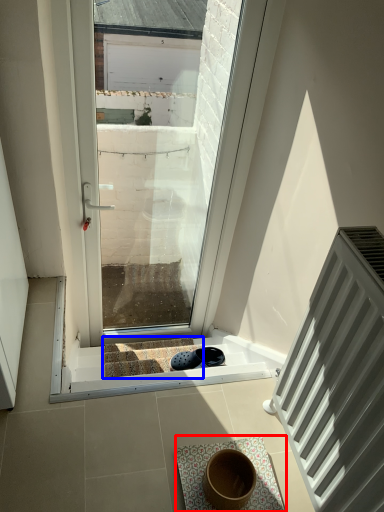
Question: Which object is closer to the camera taking this photo, bath mat (highlighted by a red box) or stairwell (highlighted by a blue box)?

Choices:
 (A) bath mat
 (B) stairwell

Answer: (A)